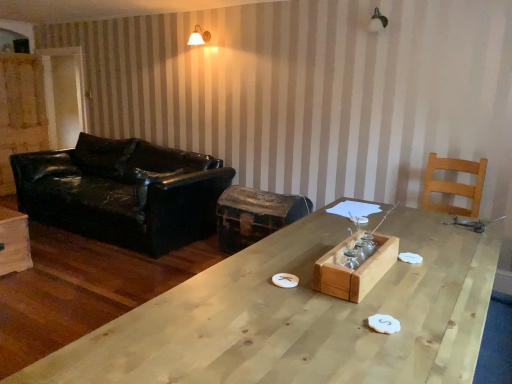
Question: From the image's perspective, would you say wooden tray at center is shown under light brown wooden chair at right?

Choices:
 (A) no
 (B) yes

Answer: (B)

Question: Can you see wooden tray at center touching light brown wooden chair at right?

Choices:
 (A) yes
 (B) no

Answer: (B)

Question: From a real-world perspective, is wooden tray at center located beneath light brown wooden chair at right?

Choices:
 (A) no
 (B) yes

Answer: (B)

Question: Can you confirm if wooden tray at center is wider than light brown wooden chair at right?

Choices:
 (A) no
 (B) yes

Answer: (A)

Question: Is wooden tray at center looking in the opposite direction of light brown wooden chair at right?

Choices:
 (A) yes
 (B) no

Answer: (B)

Question: Would you say wooden tray at center contains light brown wooden chair at right?

Choices:
 (A) yes
 (B) no

Answer: (B)

Question: Is black leather couch at left thinner than light brown wooden chair at right?

Choices:
 (A) no
 (B) yes

Answer: (A)

Question: Is black leather couch at left placed right next to light brown wooden chair at right?

Choices:
 (A) no
 (B) yes

Answer: (A)

Question: From a real-world perspective, is black leather couch at left beneath light brown wooden chair at right?

Choices:
 (A) yes
 (B) no

Answer: (A)

Question: Is black leather couch at left positioned with its back to light brown wooden chair at right?

Choices:
 (A) yes
 (B) no

Answer: (B)

Question: Is black leather couch at left positioned beyond the bounds of light brown wooden chair at right?

Choices:
 (A) yes
 (B) no

Answer: (A)

Question: Is black leather couch at left not near light brown wooden chair at right?

Choices:
 (A) no
 (B) yes

Answer: (B)

Question: Is rusty metal trunk at center positioned beyond the bounds of natural wood table at center?

Choices:
 (A) yes
 (B) no

Answer: (A)